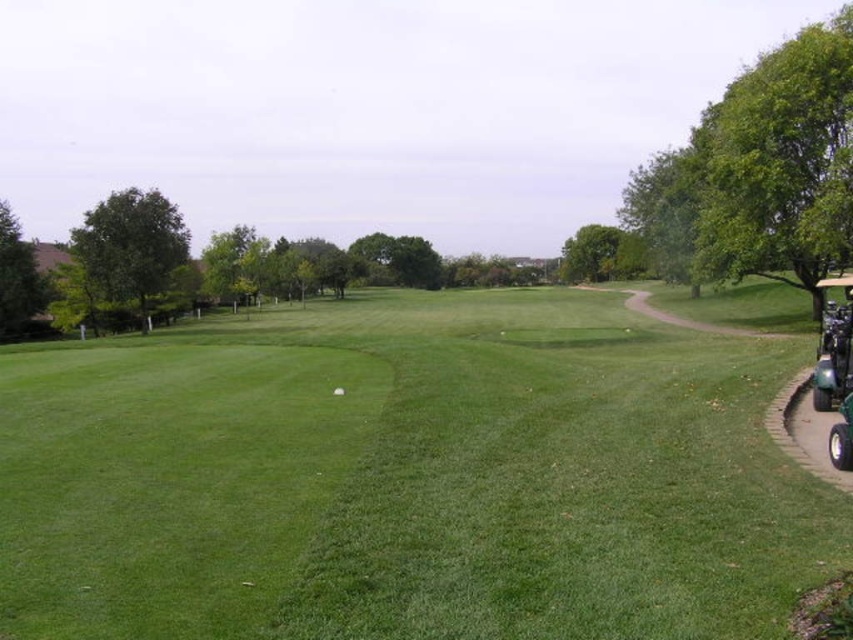
Can you confirm if green grassy field at center is positioned to the right of green rubber golf cart at right?

No, green grassy field at center is not to the right of green rubber golf cart at right.

Based on the photo, does green grassy field at center have a lesser width compared to green rubber golf cart at right?

No.

Find the location of a particular element. The height and width of the screenshot is (640, 853). green grassy field at center is located at coordinates (407, 480).

The width and height of the screenshot is (853, 640). I want to click on green grassy field at center, so click(407, 480).